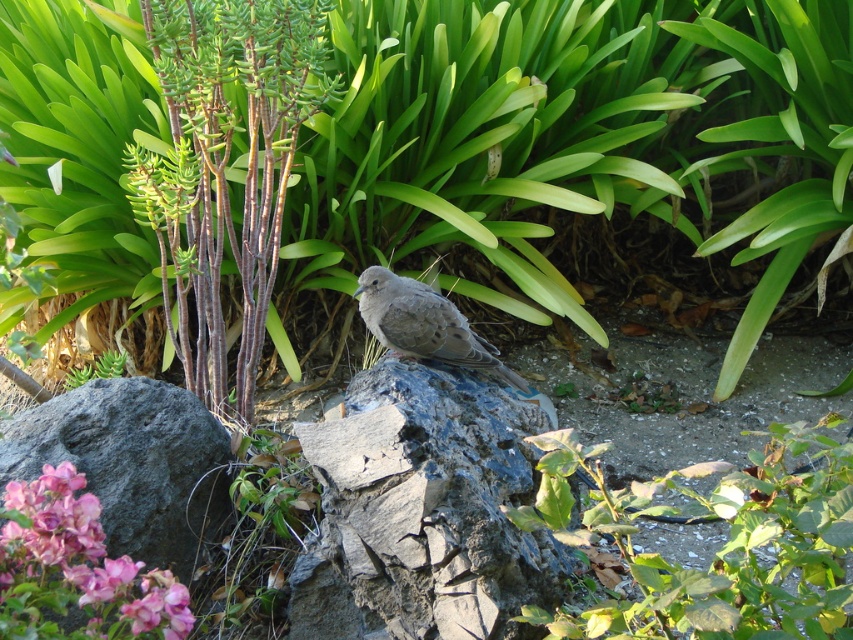
Does green leafy plant at center have a greater width compared to brown feathered bird at center?

Correct, the width of green leafy plant at center exceeds that of brown feathered bird at center.

Is green leafy plant at center thinner than brown feathered bird at center?

Incorrect, green leafy plant at center's width is not less than brown feathered bird at center's.

Locate an element on the screen. The height and width of the screenshot is (640, 853). green leafy plant at center is located at coordinates (720, 548).

Who is taller, green leafy plant at center or pink matte petals at center?

Standing taller between the two is green leafy plant at center.

Is point (740, 538) positioned behind point (91, 600)?

Yes, point (740, 538) is farther from viewer.

I want to click on green leafy plant at center, so click(x=720, y=548).

Between gray rough rock at center and brown feathered bird at center, which one appears on the left side from the viewer's perspective?

From the viewer's perspective, brown feathered bird at center appears more on the left side.

Is gray rough rock at center wider than brown feathered bird at center?

Indeed, gray rough rock at center has a greater width compared to brown feathered bird at center.

Is point (381, 506) positioned in front of point (422, 356)?

That is True.

This screenshot has width=853, height=640. I want to click on gray rough rock at center, so click(x=422, y=509).